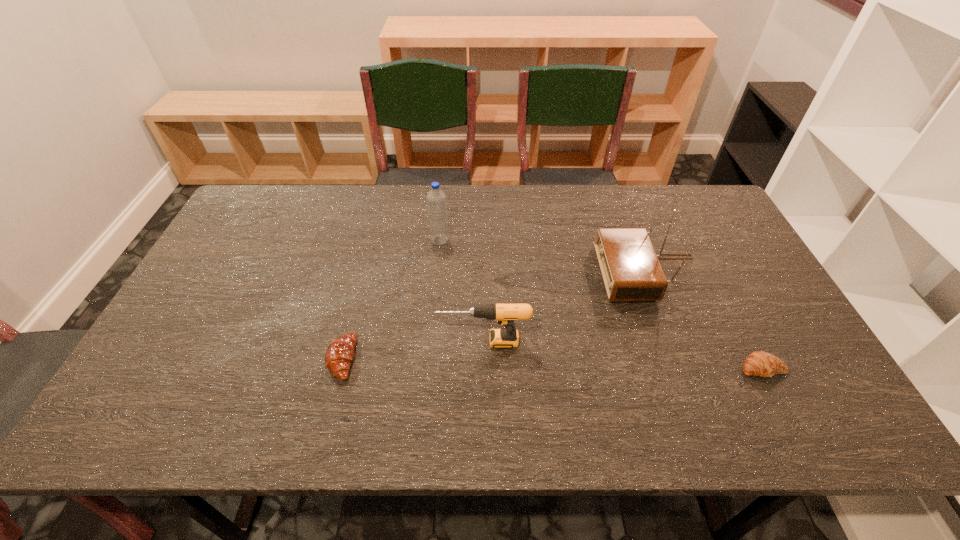
The width and height of the screenshot is (960, 540). Identify the location of free space between the water bottle and the right crescent roll. (601, 304).

You are a GUI agent. You are given a task and a screenshot of the screen. Output one action in this format:
    pyautogui.click(x=<x>, y=<y>)
    Task: Click on the vacant space that's between the radio_receiver and the third tallest object
    This screenshot has height=540, width=960.
    Given the screenshot: What is the action you would take?
    pyautogui.click(x=566, y=307)

Image resolution: width=960 pixels, height=540 pixels. I want to click on blank region between the water bottle and the radio_receiver, so click(x=544, y=256).

What are the coordinates of `free space between the right crescent roll and the leftmost object` in the screenshot? It's located at (552, 363).

Image resolution: width=960 pixels, height=540 pixels. Find the location of `vacant space that's between the right crescent roll and the third shortest object`. vacant space that's between the right crescent roll and the third shortest object is located at coordinates (623, 355).

I want to click on free space that is in between the radio_receiver and the drill, so click(x=566, y=307).

What are the coordinates of `vacant region between the right crescent roll and the leftmost object` in the screenshot? It's located at (552, 363).

Find the location of a particular element. Image resolution: width=960 pixels, height=540 pixels. vacant area that lies between the third shortest object and the right crescent roll is located at coordinates (623, 355).

Where is `empty location between the drill and the radio_receiver`? empty location between the drill and the radio_receiver is located at coordinates (566, 307).

Find the location of a particular element. The width and height of the screenshot is (960, 540). object that can be found as the second closest to the third tallest object is located at coordinates (631, 271).